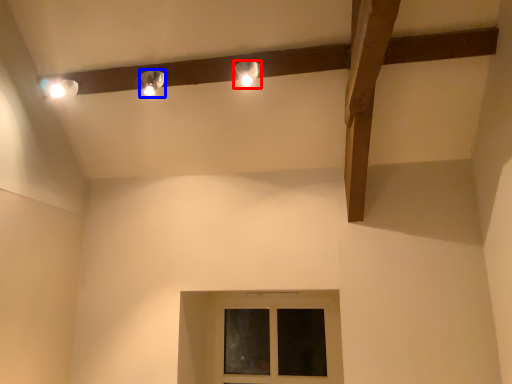
Question: Which object is closer to the camera taking this photo, lamp (highlighted by a red box) or lamp (highlighted by a blue box)?

Choices:
 (A) lamp
 (B) lamp

Answer: (A)